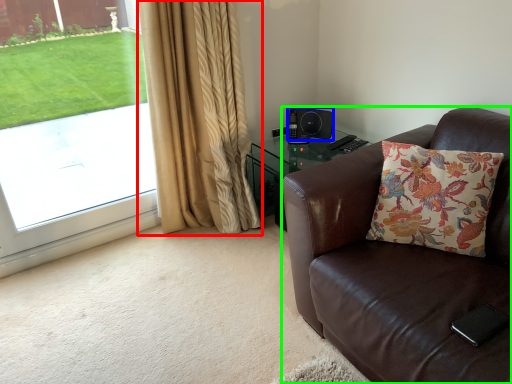
Question: Estimate the real-world distances between objects in this image. Which object is closer to curtain (highlighted by a red box), speaker (highlighted by a blue box) or chair (highlighted by a green box)?

Choices:
 (A) speaker
 (B) chair

Answer: (A)